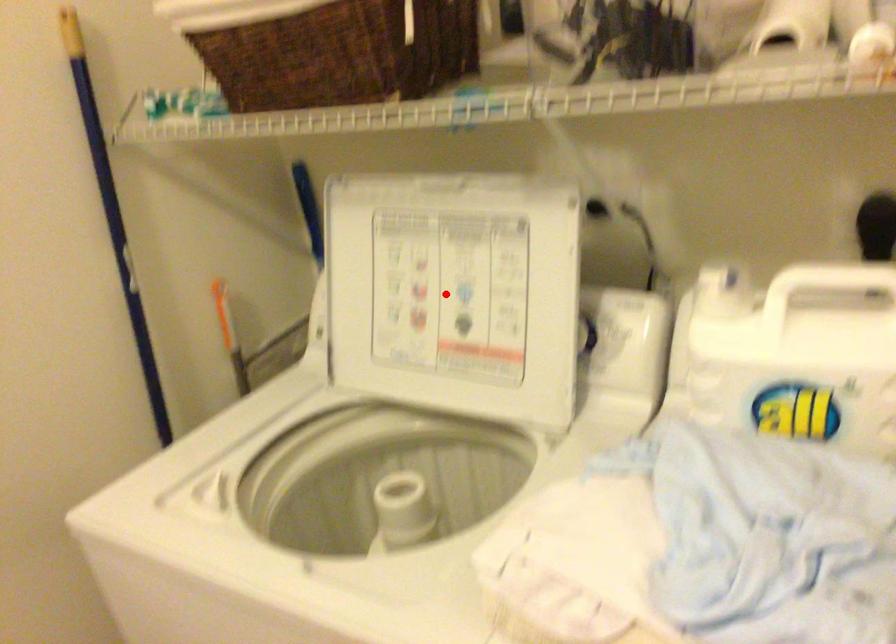
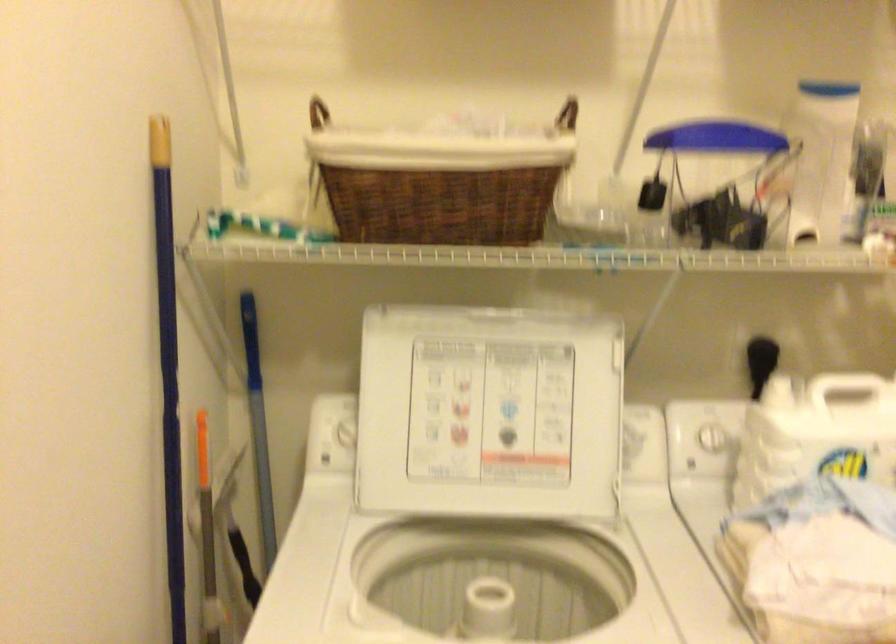
Question: I am providing you with two images of the same scene from different viewpoints. A red point is shown in image1. For the corresponding object point in image2, is it positioned nearer or farther from the camera?

Choices:
 (A) Nearer
 (B) Farther

Answer: (B)